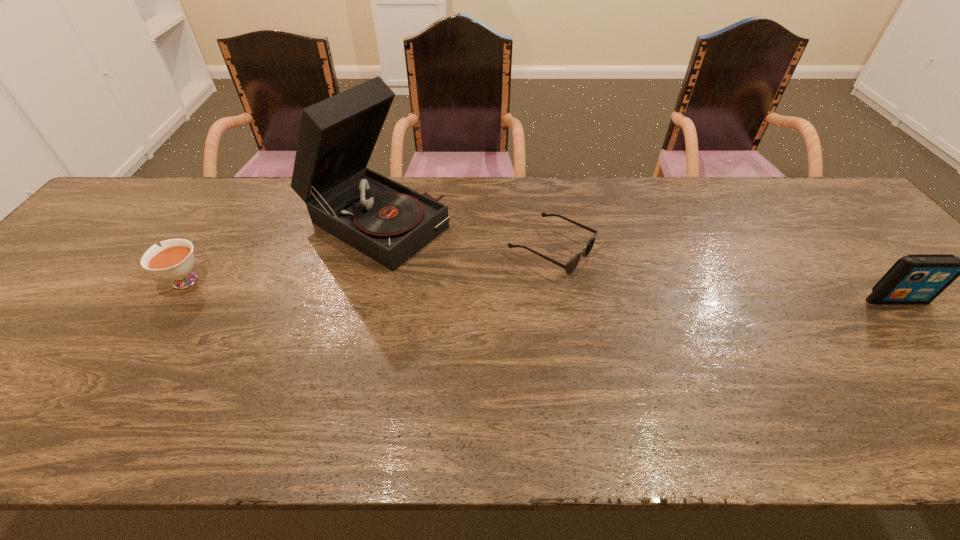
The image size is (960, 540). I want to click on free spot between the rightmost object and the teacup, so [x=540, y=291].

Where is `blank region between the shortest object and the rightmost object`? The height and width of the screenshot is (540, 960). blank region between the shortest object and the rightmost object is located at coordinates (724, 275).

The width and height of the screenshot is (960, 540). What are the coordinates of `vacant space that is in between the sunglasses and the rightmost object` in the screenshot? It's located at (724, 275).

Find the location of a particular element. vacant space that's between the shortest object and the phonograph_record is located at coordinates (463, 236).

The height and width of the screenshot is (540, 960). I want to click on empty space that is in between the third object from right to left and the leftmost object, so click(x=278, y=252).

Where is `vacant area that lies between the sunglasses and the second tallest object`? The height and width of the screenshot is (540, 960). vacant area that lies between the sunglasses and the second tallest object is located at coordinates (724, 275).

Locate an element on the screen. The image size is (960, 540). object that stands as the closest to the rightmost object is located at coordinates (572, 264).

Select which object appears as the third closest to the leftmost object. Please provide its 2D coordinates. Your answer should be formatted as a tuple, i.e. [(x, y)], where the tuple contains the x and y coordinates of a point satisfying the conditions above.

[(916, 278)]

You are a GUI agent. You are given a task and a screenshot of the screen. Output one action in this format:
    pyautogui.click(x=<x>, y=<y>)
    Task: Click on the free space in the image that satisfies the following two spatial constraints: 1. on the front side of the phonograph_record; 2. on the left side of the shortest object
    The image size is (960, 540).
    Given the screenshot: What is the action you would take?
    pyautogui.click(x=368, y=250)

At what (x,y) coordinates should I click in order to perform the action: click on vacant area that satisfies the following two spatial constraints: 1. on the front side of the phonograph_record; 2. on the right side of the shortest object. Please return your answer as a coordinate pair (x, y). The width and height of the screenshot is (960, 540). Looking at the image, I should click on (368, 250).